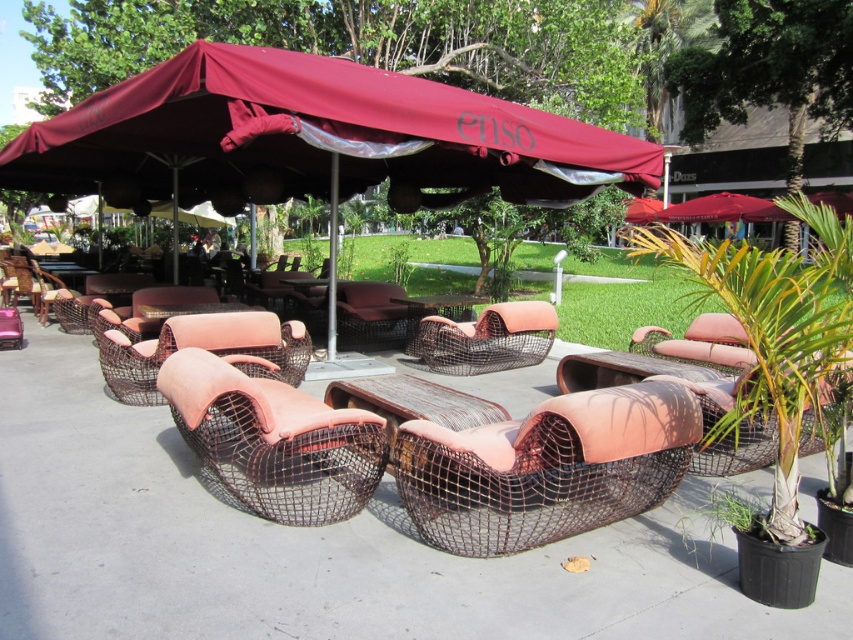
Does rattan wicker armchair at center have a greater height compared to rustic wicker table at center?

Yes, rattan wicker armchair at center is taller than rustic wicker table at center.

I want to click on rattan wicker armchair at center, so click(486, 339).

Who is more forward, (523,305) or (440,298)?

Point (523,305) is more forward.

Locate an element on the screen. The height and width of the screenshot is (640, 853). rattan wicker armchair at center is located at coordinates (486, 339).

Does point (349, 140) come farther from viewer compared to point (392, 305)?

No.

Based on the photo, measure the distance between maroon fabric canopy at upper center and camera.

They are 4.07 meters apart.

What do you see at coordinates (317, 134) in the screenshot? I see `maroon fabric canopy at upper center` at bounding box center [317, 134].

The width and height of the screenshot is (853, 640). Find the location of `maroon fabric canopy at upper center`. maroon fabric canopy at upper center is located at coordinates click(317, 134).

Describe the element at coordinates (546, 468) in the screenshot. I see `rustic woven armchair at center` at that location.

How distant is rustic woven armchair at center from rattan wicker armchair at center?

rustic woven armchair at center is 11.58 feet from rattan wicker armchair at center.

Does point (408, 515) lie in front of point (520, 316)?

Yes.

You are a GUI agent. You are given a task and a screenshot of the screen. Output one action in this format:
    pyautogui.click(x=<x>, y=<y>)
    Task: Click on the rustic woven armchair at center
    
    Given the screenshot: What is the action you would take?
    pyautogui.click(x=546, y=468)